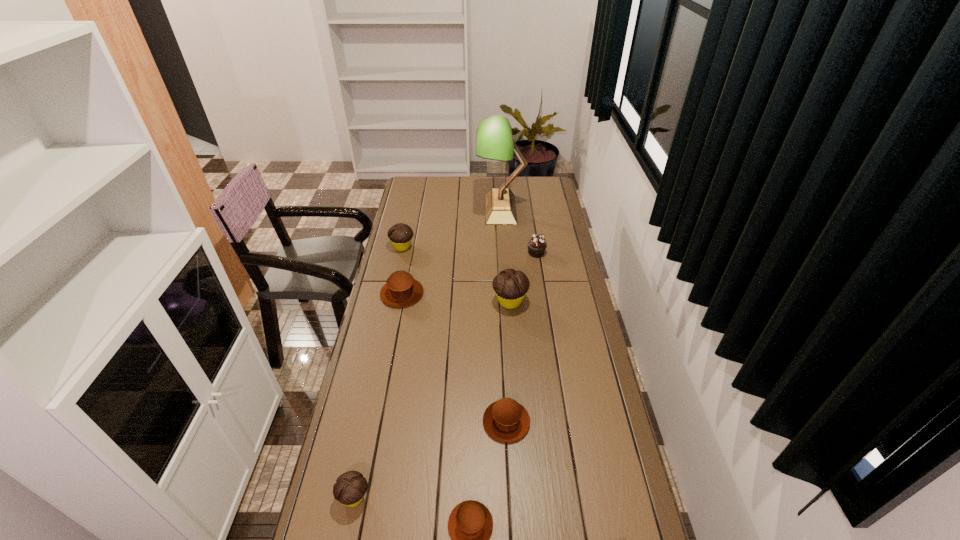
Locate an element on the screen. the tallest object is located at coordinates (494, 140).

Where is `table lamp`? Image resolution: width=960 pixels, height=540 pixels. table lamp is located at coordinates (494, 140).

Locate an element on the screen. the second tallest object is located at coordinates (510, 286).

You are a GUI agent. You are given a task and a screenshot of the screen. Output one action in this format:
    pyautogui.click(x=<x>, y=<y>)
    Task: Click on the tallest muffin
    The image size is (960, 540).
    Given the screenshot: What is the action you would take?
    pyautogui.click(x=510, y=286)

Locate an element on the screen. Image resolution: width=960 pixels, height=540 pixels. the farthest chocolate muffin is located at coordinates (400, 235).

At what (x,y) coordinates should I click in order to perform the action: click on the second smallest chocolate muffin. Please return your answer as a coordinate pair (x, y). Looking at the image, I should click on (400, 235).

Where is `the leftmost brown muffin`? Image resolution: width=960 pixels, height=540 pixels. the leftmost brown muffin is located at coordinates (401, 290).

The image size is (960, 540). I want to click on the biggest brown muffin, so click(401, 290).

I want to click on brown cupcake, so click(537, 244).

Find the location of `the second biggest brown muffin`. the second biggest brown muffin is located at coordinates (505, 420).